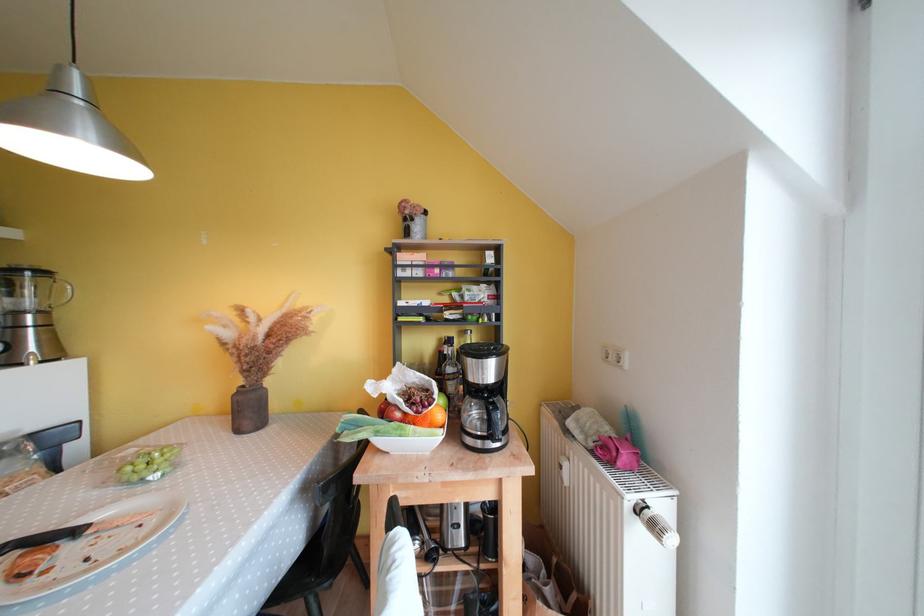
Identify the location of coffee maker lid. (482, 350).